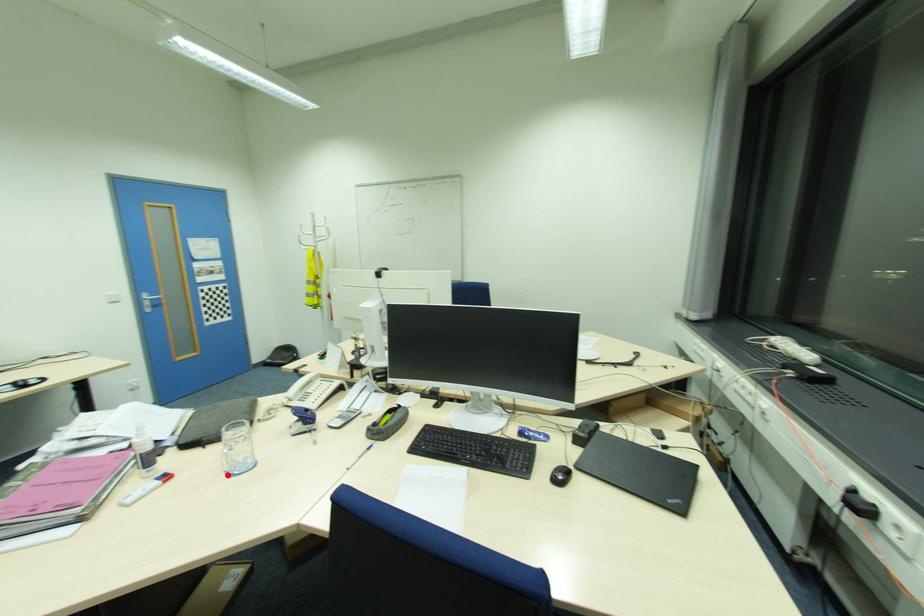
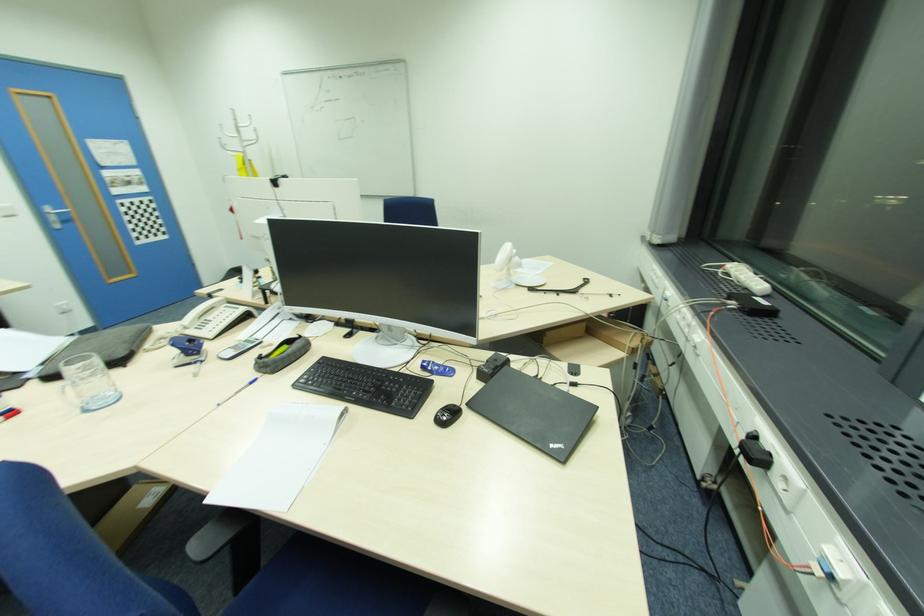
The point at the highlighted location is marked in the first image. Where is the corresponding point in the second image?

(80, 413)